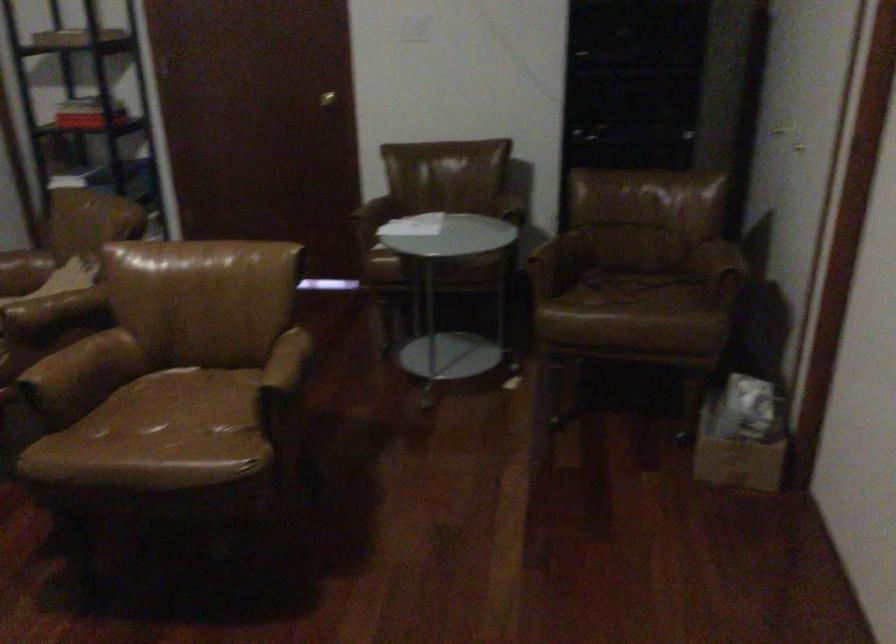
Describe the element at coordinates (326, 99) in the screenshot. I see `the brass door knob` at that location.